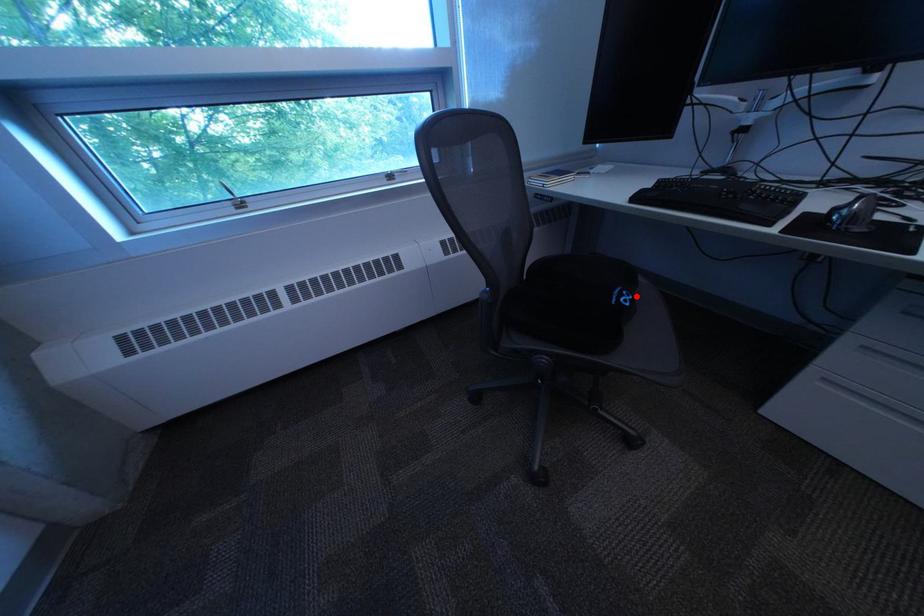
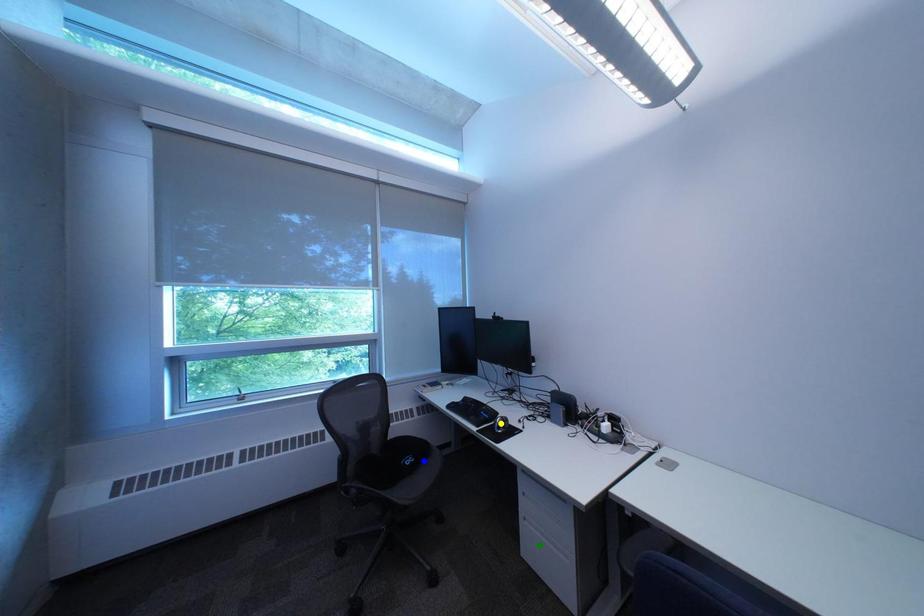
Question: I am providing you with two images of the same scene from different viewpoints. A red point is marked on the first image. You are given multiple points on the second image. Can you choose the point in image 2 that corresponds to the point in image 1?

Choices:
 (A) yellow point
 (B) blue point
 (C) green point

Answer: (B)